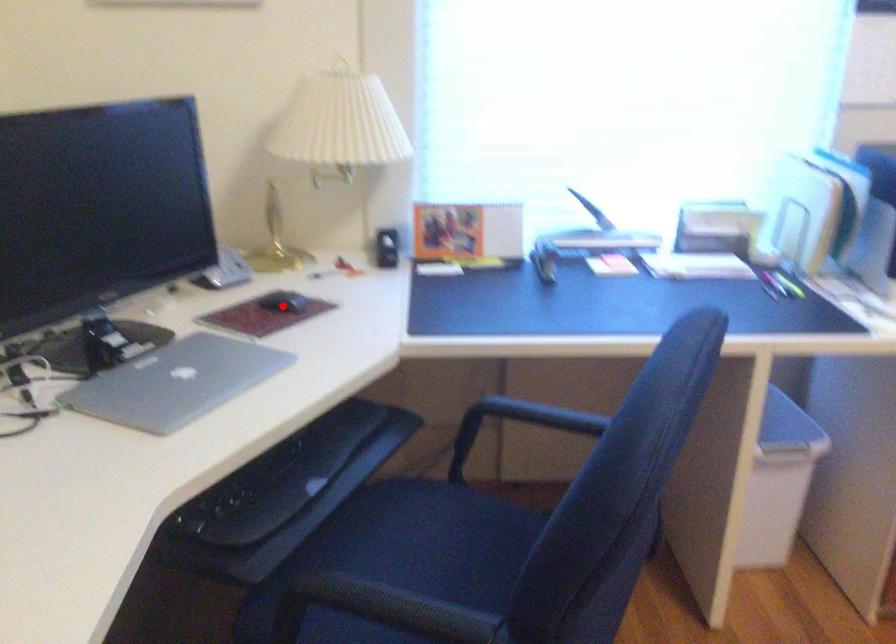
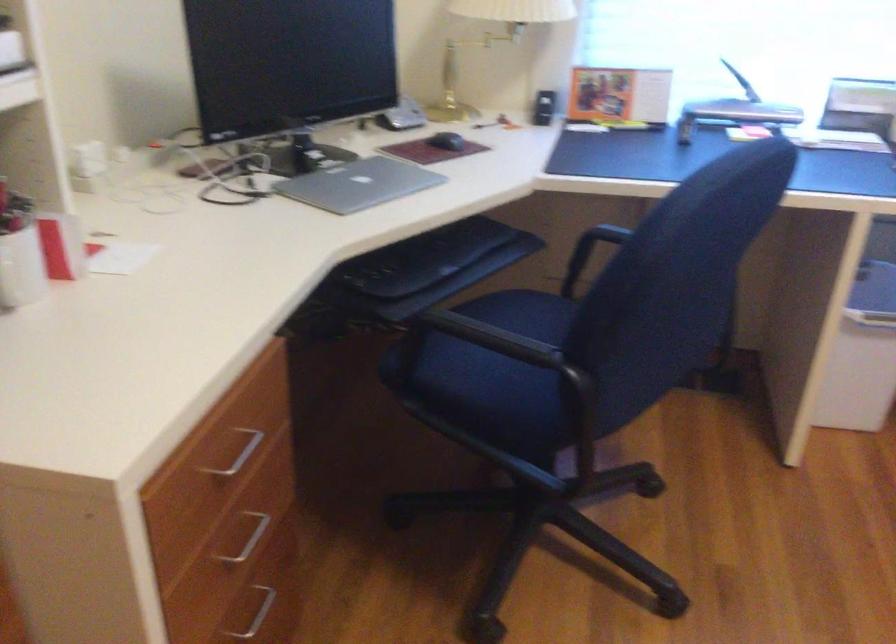
In the second image, find the point that corresponds to the highlighted location in the first image.

(446, 140)